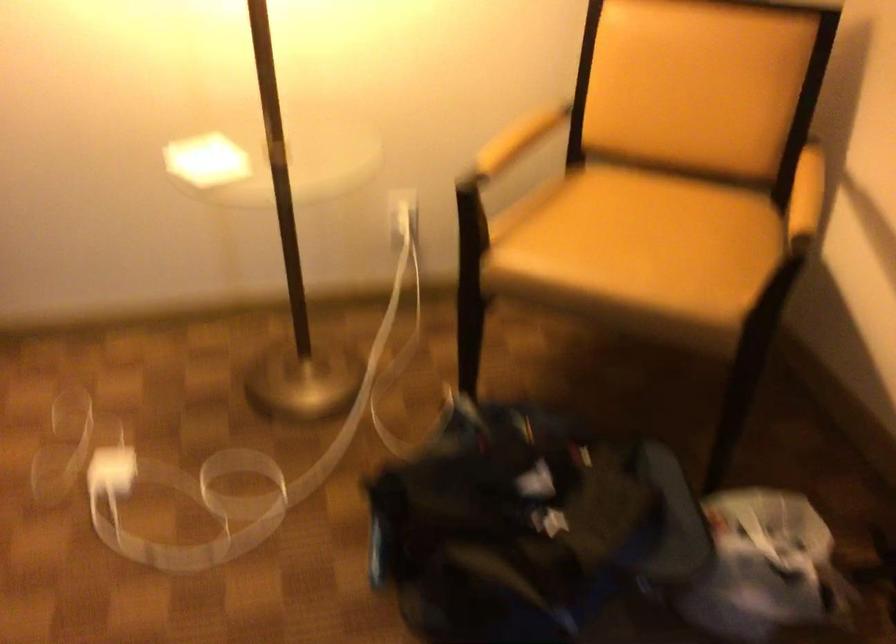
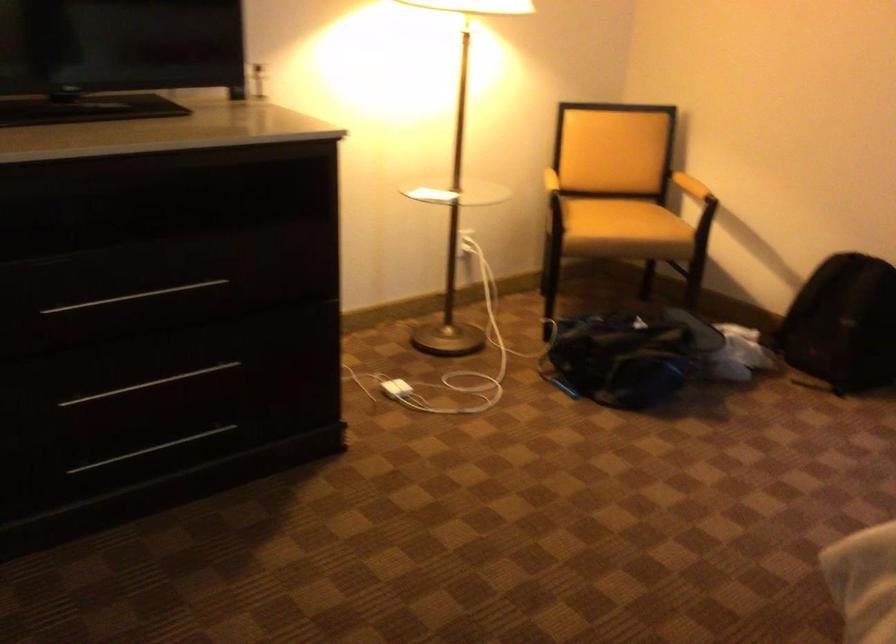
Where in the second image is the point corresponding to pixel 618 257 from the first image?

(623, 220)